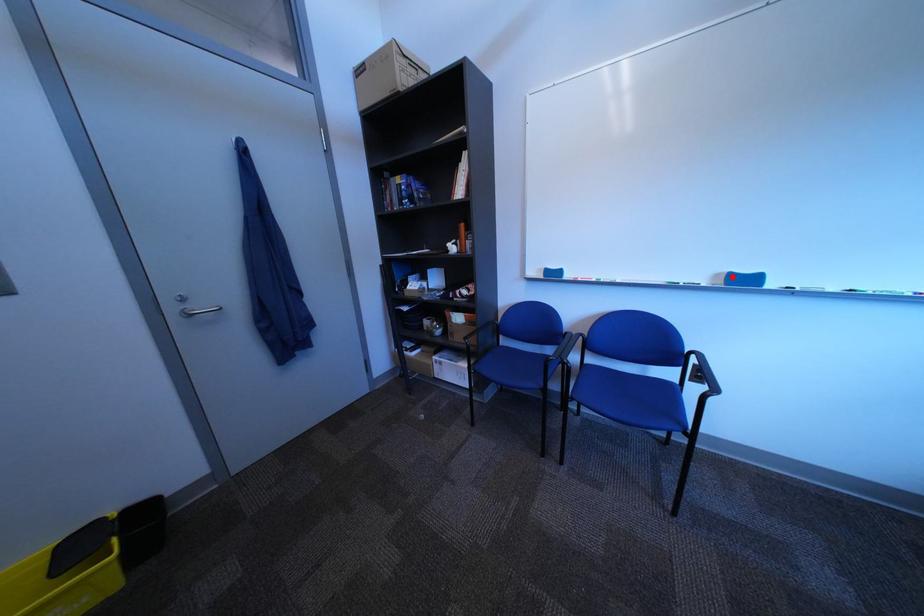
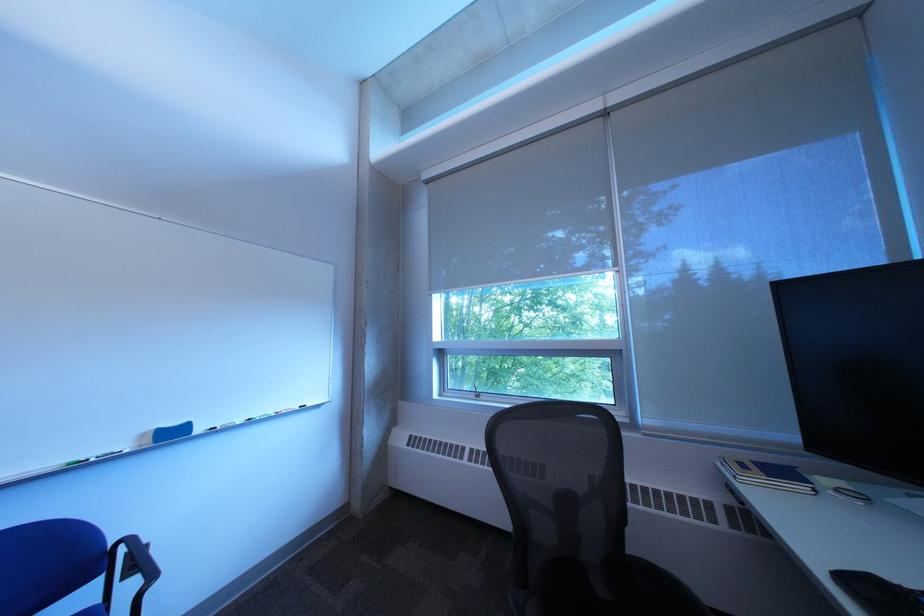
Where in the second image is the point corresponding to the highlighted location from the first image?

(159, 437)